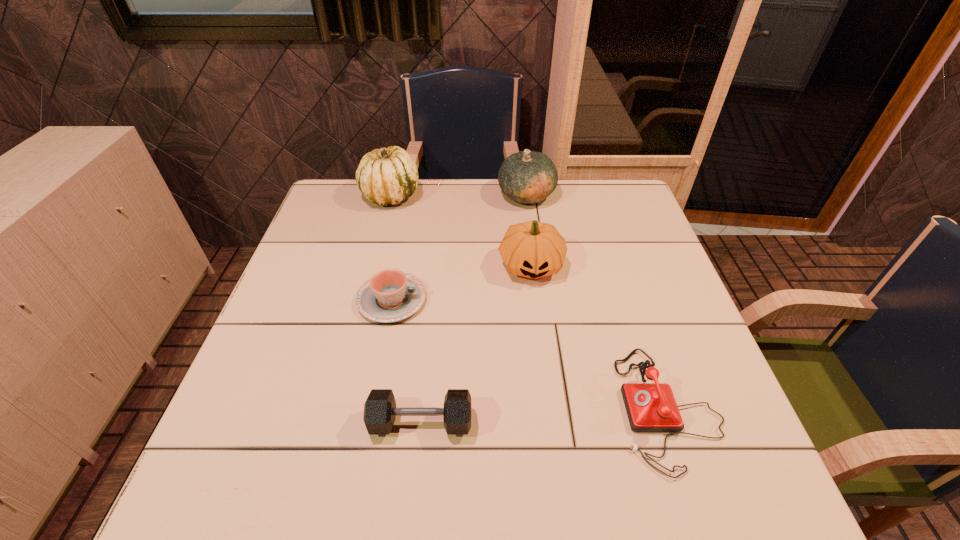
Where is `gourd that is the second nearest to the leftmost gourd`? This screenshot has height=540, width=960. gourd that is the second nearest to the leftmost gourd is located at coordinates (532, 249).

This screenshot has width=960, height=540. I want to click on free region that satisfies the following two spatial constraints: 1. on the handle side of the dumbbell; 2. on the left side of the shortest object, so click(368, 422).

Locate an element on the screen. free space that satisfies the following two spatial constraints: 1. on the handle side of the dumbbell; 2. on the left side of the chinaware is located at coordinates (368, 422).

You are a GUI agent. You are given a task and a screenshot of the screen. Output one action in this format:
    pyautogui.click(x=<x>, y=<y>)
    Task: Click on the free space that satisfies the following two spatial constraints: 1. on the handle side of the dumbbell; 2. on the right side of the chinaware
    
    Given the screenshot: What is the action you would take?
    pyautogui.click(x=368, y=422)